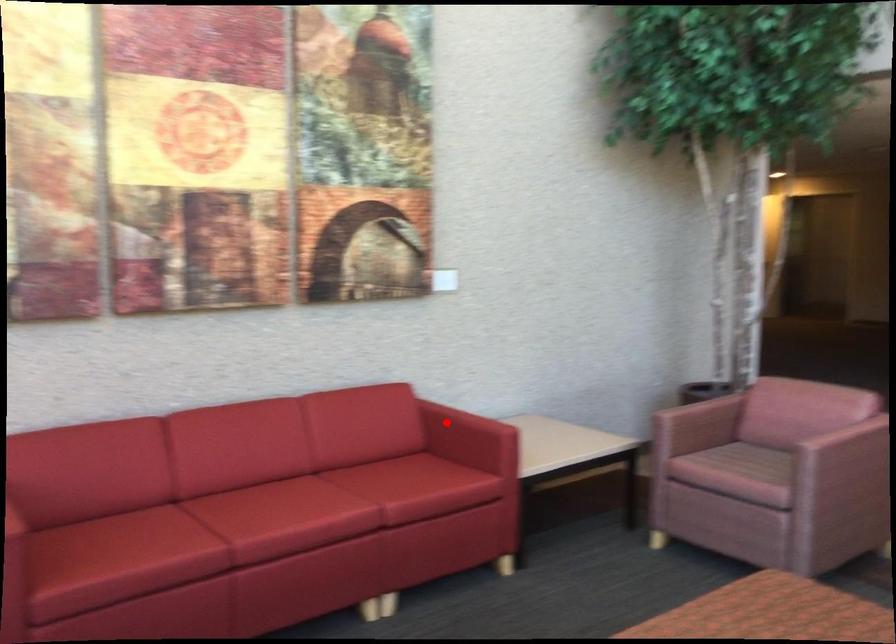
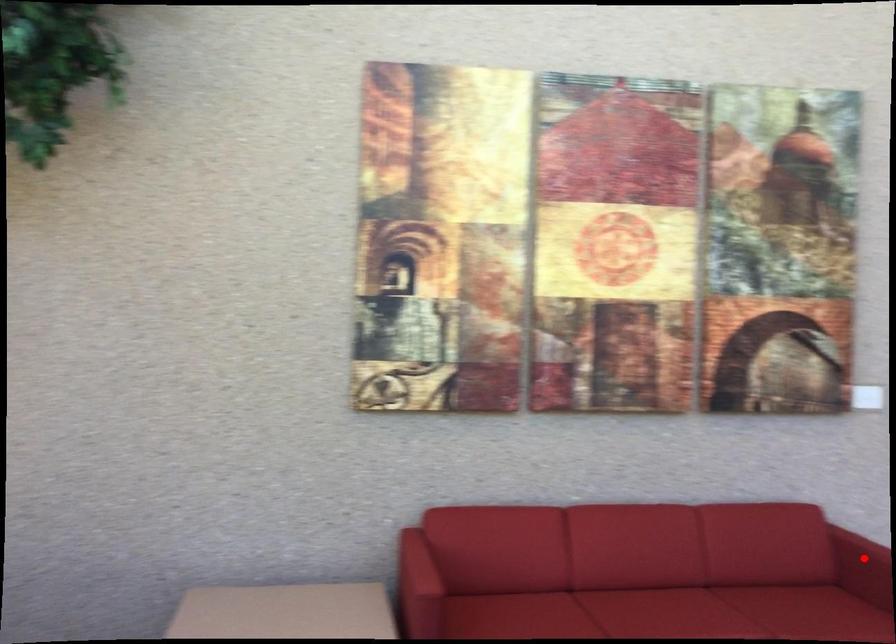
I am providing you with two images of the same scene from different viewpoints. A red point is marked on the first image and another point is marked on the second image. Is the marked point in image1 the same physical position as the marked point in image2?

Yes